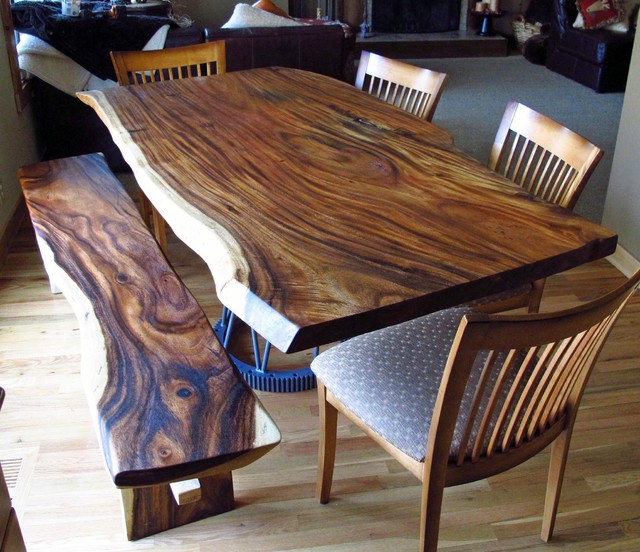
Where is `hearth`? The height and width of the screenshot is (552, 640). hearth is located at coordinates (387, 38).